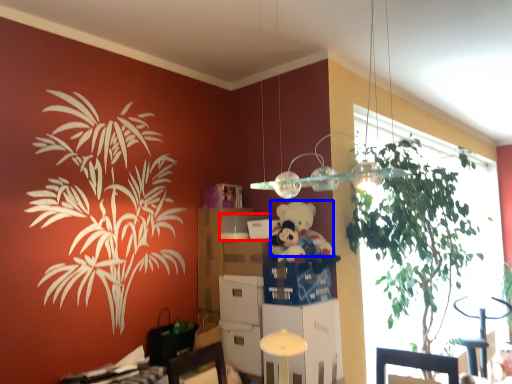
Question: Which point is closer to the camera, box (highlighted by a red box) or teddy (highlighted by a blue box)?

Choices:
 (A) box
 (B) teddy

Answer: (B)